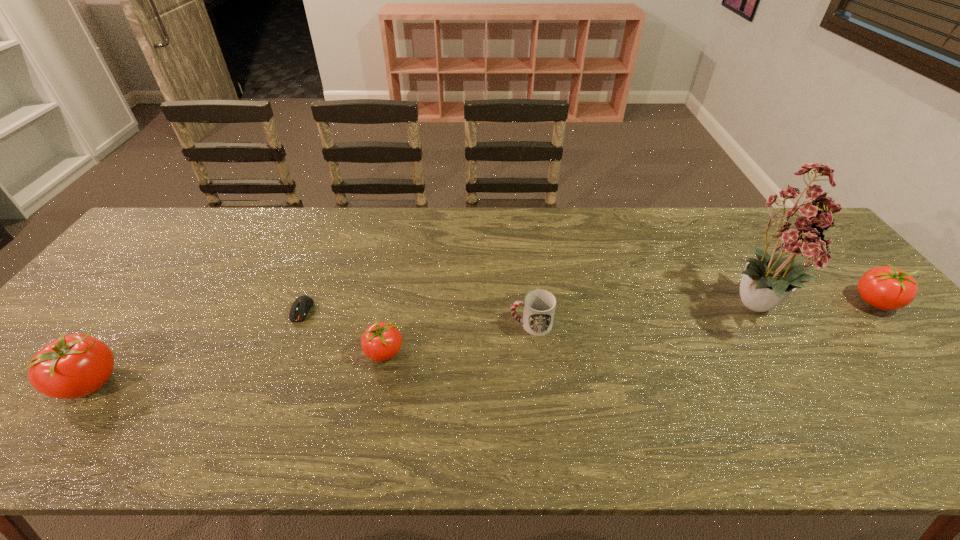
You are a GUI agent. You are given a task and a screenshot of the screen. Output one action in this format:
    pyautogui.click(x=<x>, y=<y>)
    Task: Click on the tallest object
    
    Given the screenshot: What is the action you would take?
    pyautogui.click(x=800, y=229)

Locate an element on the screen. The height and width of the screenshot is (540, 960). vacant space located on the back of the second tallest object is located at coordinates click(147, 309).

Image resolution: width=960 pixels, height=540 pixels. In order to click on vacant space located 0.120m on the back of the fourth object from right to left in this screenshot , I will do `click(393, 303)`.

At what (x,y) coordinates should I click in order to perform the action: click on free space located 0.250m on the left of the farthest tomato. Please return your answer as a coordinate pair (x, y). Image resolution: width=960 pixels, height=540 pixels. Looking at the image, I should click on (760, 302).

This screenshot has height=540, width=960. I want to click on vacant position located 0.250m on the side of the fourth object from left to right where the handle is located, so click(x=413, y=325).

At what (x,y) coordinates should I click in order to perform the action: click on vacant space located on the side of the fourth object from left to right where the handle is located. Please return your answer as a coordinate pair (x, y). The height and width of the screenshot is (540, 960). Looking at the image, I should click on (397, 325).

You are a GUI agent. You are given a task and a screenshot of the screen. Output one action in this format:
    pyautogui.click(x=<x>, y=<y>)
    Task: Click on the vacant position located 0.260m on the side of the fourth object from left to right where the handle is located
    This screenshot has width=960, height=540.
    Given the screenshot: What is the action you would take?
    pyautogui.click(x=409, y=325)

Identify the location of vacant region located 0.140m on the button of the shortest object. This screenshot has width=960, height=540. (278, 368).

At what (x,y) coordinates should I click in order to perform the action: click on vacant area located 0.140m on the front-facing side of the tallest object. Please return your answer as a coordinate pair (x, y). Image resolution: width=960 pixels, height=540 pixels. Looking at the image, I should click on (818, 399).

The image size is (960, 540). I want to click on object situated at the near edge, so click(x=73, y=366).